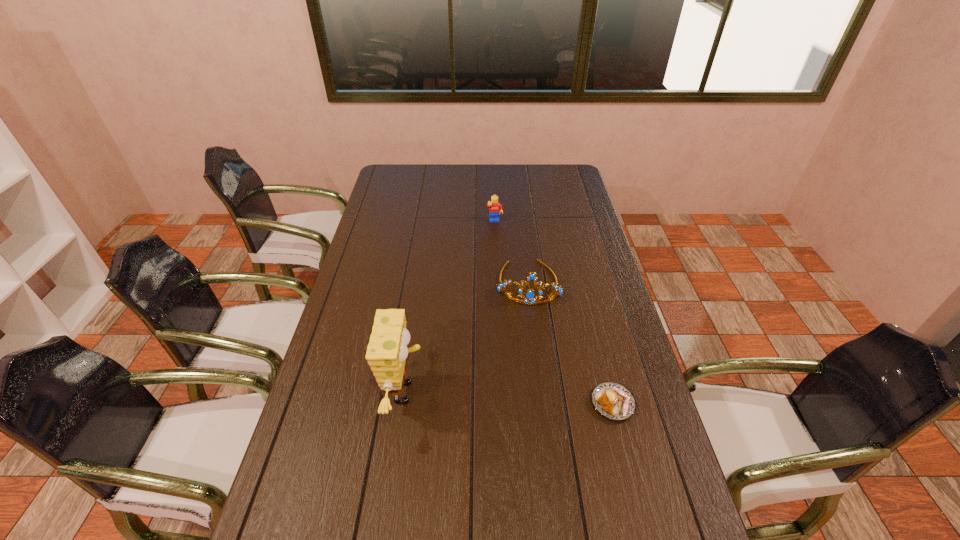
Image resolution: width=960 pixels, height=540 pixels. What are the coordinates of `vacant region at the far left corner of the desktop` in the screenshot? It's located at (408, 186).

Locate an element on the screen. vacant point located between the sponge and the second tallest object is located at coordinates (468, 338).

Where is `free point between the rightmost object and the sponge`? free point between the rightmost object and the sponge is located at coordinates (509, 398).

This screenshot has width=960, height=540. In order to click on free spot between the shortest object and the tiara in this screenshot , I will do `click(570, 343)`.

Find the location of a particular element. This screenshot has height=540, width=960. free space between the farthest object and the second farthest object is located at coordinates (512, 252).

I want to click on vacant region between the tallest object and the second tallest object, so click(x=468, y=338).

This screenshot has width=960, height=540. I want to click on empty space that is in between the shortest object and the leftmost object, so tap(509, 398).

Identify the location of vacant area between the rightmost object and the Lego. (554, 313).

I want to click on free space between the tiara and the farthest object, so click(x=512, y=252).

In order to click on free space between the Lego and the shortest object in this screenshot , I will do `click(554, 313)`.